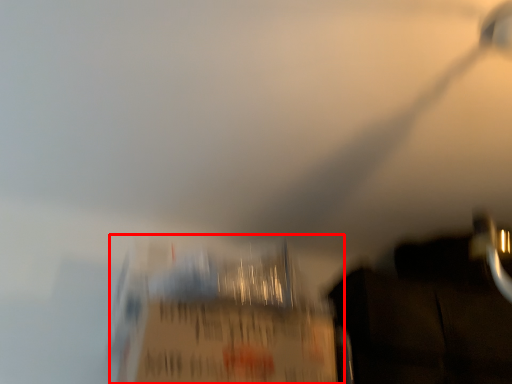
Question: Where is cardboard box (annotated by the red box) located in relation to dark in the image?

Choices:
 (A) right
 (B) left

Answer: (B)